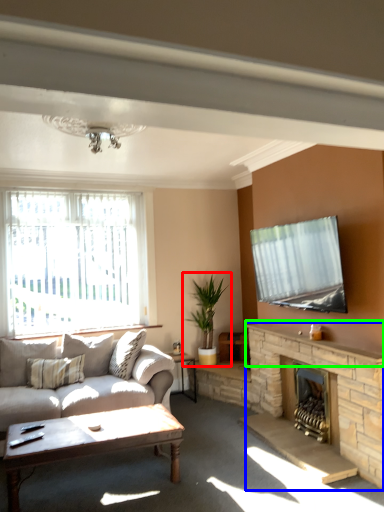
Question: Which object is the farthest from houseplant (highlighted by a red box)? Choose among these: fireplace (highlighted by a blue box) or mantle (highlighted by a green box).

Choices:
 (A) fireplace
 (B) mantle

Answer: (A)